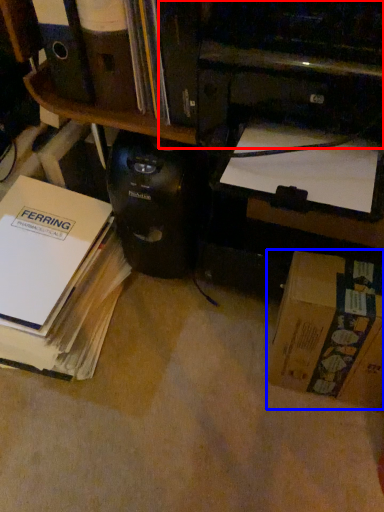
Question: Among these objects, which one is farthest to the camera, printer (highlighted by a red box) or box (highlighted by a blue box)?

Choices:
 (A) printer
 (B) box

Answer: (B)